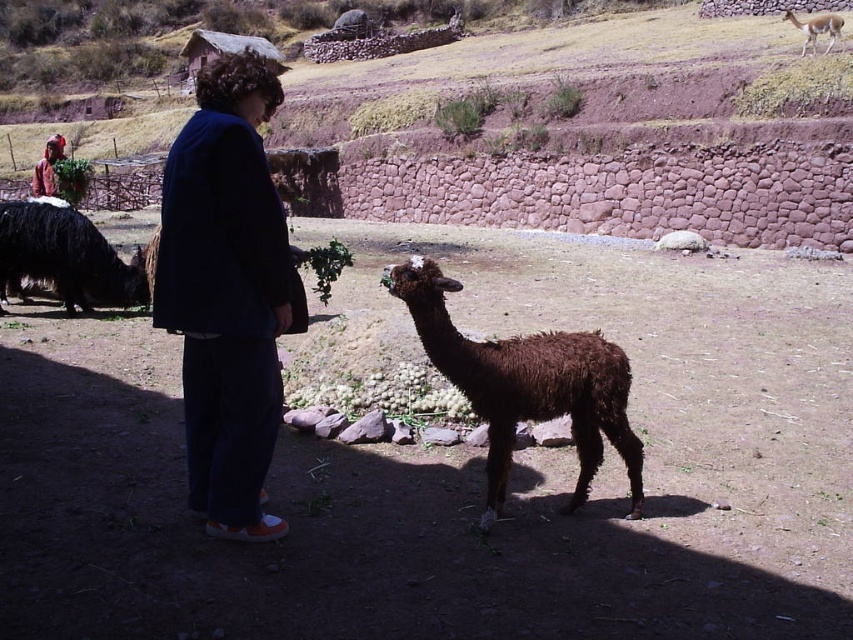
Question: Does dark blue fabric at center appear on the right side of light brown fur camel at upper right?

Choices:
 (A) yes
 (B) no

Answer: (B)

Question: Can you confirm if brown woolly alpaca at center is positioned to the left of light brown fur camel at upper right?

Choices:
 (A) yes
 (B) no

Answer: (A)

Question: Among these points, which one is nearest to the camera?

Choices:
 (A) pyautogui.click(x=218, y=465)
 (B) pyautogui.click(x=825, y=22)
 (C) pyautogui.click(x=573, y=445)
 (D) pyautogui.click(x=26, y=252)

Answer: (A)

Question: Which of the following is the closest to the observer?

Choices:
 (A) brown woolly alpaca at center
 (B) dark blue fabric at center

Answer: (B)

Question: Which point is farther from the camera taking this photo?

Choices:
 (A) (271, 125)
 (B) (805, 22)
 (C) (503, 477)
 (D) (80, 289)

Answer: (A)

Question: Observing the image, what is the correct spatial positioning of black woolen llama at left in reference to light brown fur camel at upper right?

Choices:
 (A) above
 (B) below

Answer: (B)